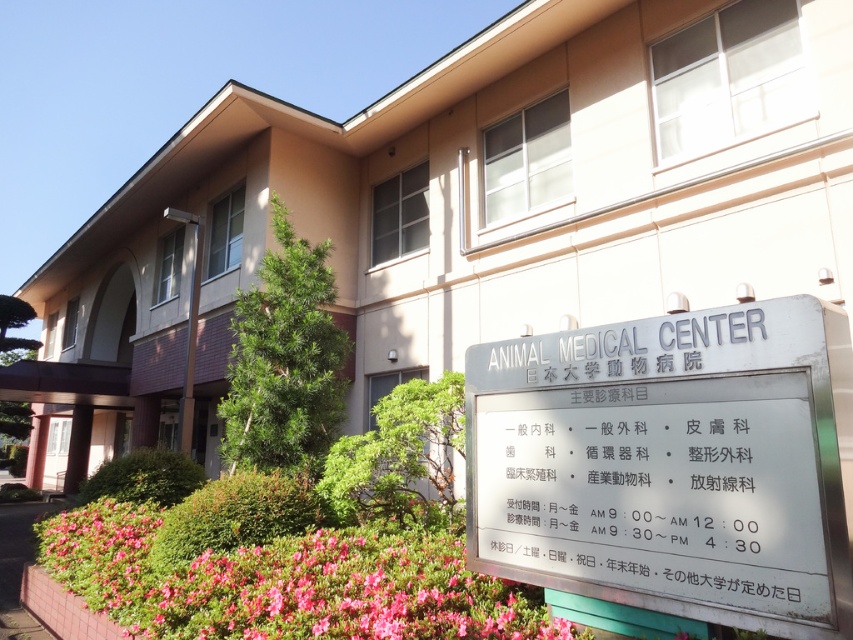
You are a visitor approaching the Animal Medical Center and see the metallic signboard at center and the pink matte flowers at lower left. Which object is taller when viewed from the front?

The metallic signboard at center is taller than the pink matte flowers at lower left.